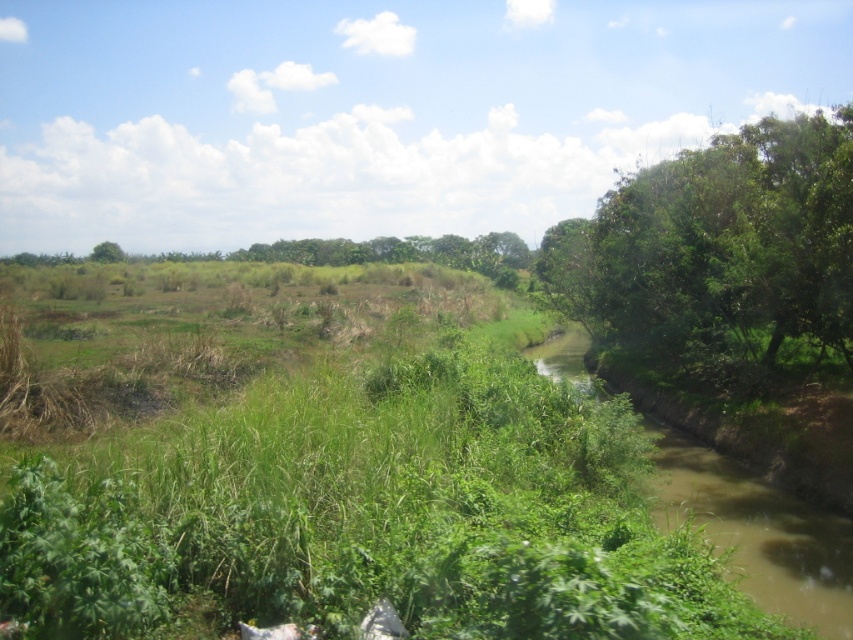
Looking at this image, which of these two, green leafy tree at right or green leafy tree at upper left, stands taller?

green leafy tree at right

Which is below, green leafy tree at right or green leafy tree at upper left?

green leafy tree at right

Which is behind, point (656, 234) or point (122, 257)?

Point (122, 257)

Identify the location of green leafy tree at right. [x=720, y=253].

Can you confirm if green leafy tree at right is positioned below brown muddy water at right?

No.

Can you confirm if green leafy tree at right is positioned to the left of brown muddy water at right?

Incorrect, green leafy tree at right is not on the left side of brown muddy water at right.

At what (x,y) coordinates should I click in order to perform the action: click on green leafy tree at right. Please return your answer as a coordinate pair (x, y). The width and height of the screenshot is (853, 640). Looking at the image, I should click on (720, 253).

Can you confirm if brown muddy water at right is positioned to the right of green leafy tree at upper left?

Correct, you'll find brown muddy water at right to the right of green leafy tree at upper left.

Who is shorter, brown muddy water at right or green leafy tree at upper left?

brown muddy water at right is shorter.

Is point (849, 595) in front of point (107, 250)?

Yes, it is.

What are the coordinates of `brown muddy water at right` in the screenshot? It's located at (757, 531).